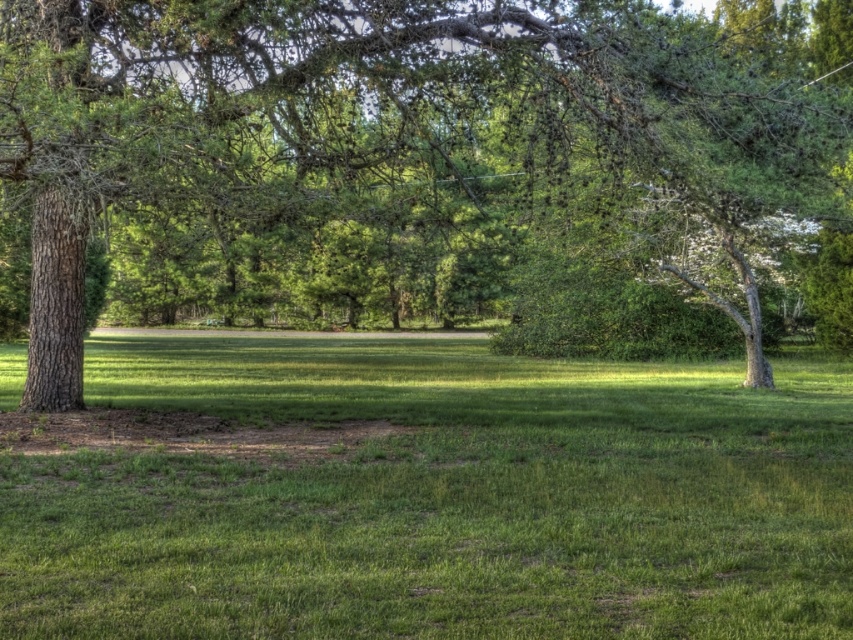
Question: Which object appears closest to the camera in this image?

Choices:
 (A) green grassy field at center
 (B) green textured tree at left

Answer: (A)

Question: Can you confirm if green textured tree at left is bigger than green grassy field at center?

Choices:
 (A) no
 (B) yes

Answer: (B)

Question: Is green textured tree at left bigger than green grassy field at center?

Choices:
 (A) yes
 (B) no

Answer: (A)

Question: Is green textured tree at left to the right of green grassy field at center from the viewer's perspective?

Choices:
 (A) no
 (B) yes

Answer: (B)